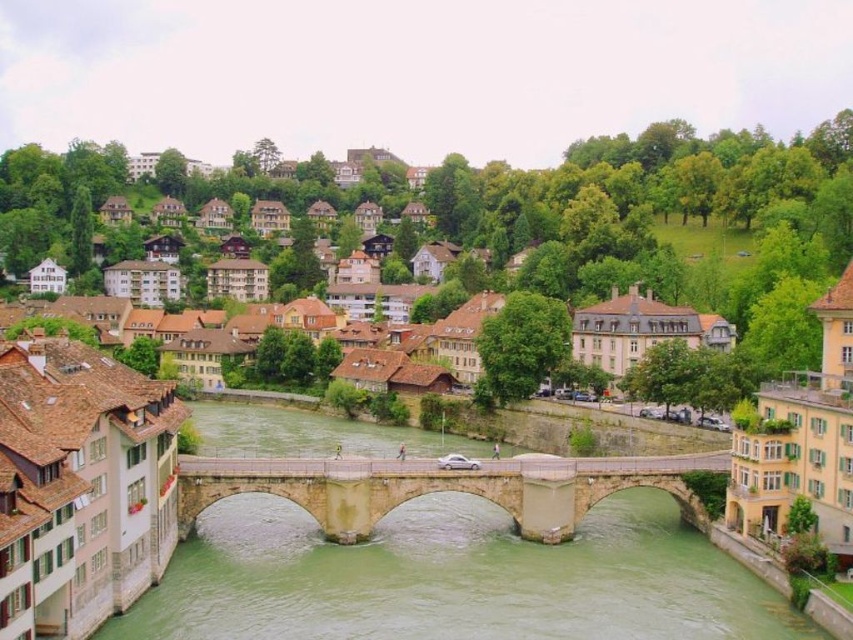
Question: Among these objects, which one is nearest to the camera?

Choices:
 (A) green stone bridge at center
 (B) stone bridge at center

Answer: (A)

Question: Can you confirm if green stone bridge at center is wider than stone bridge at center?

Choices:
 (A) yes
 (B) no

Answer: (A)

Question: Which point is farther from the camera taking this photo?

Choices:
 (A) (303, 433)
 (B) (341, 499)

Answer: (A)

Question: Does green stone bridge at center have a greater width compared to stone bridge at center?

Choices:
 (A) yes
 (B) no

Answer: (A)

Question: Does green stone bridge at center have a larger size compared to stone bridge at center?

Choices:
 (A) no
 (B) yes

Answer: (B)